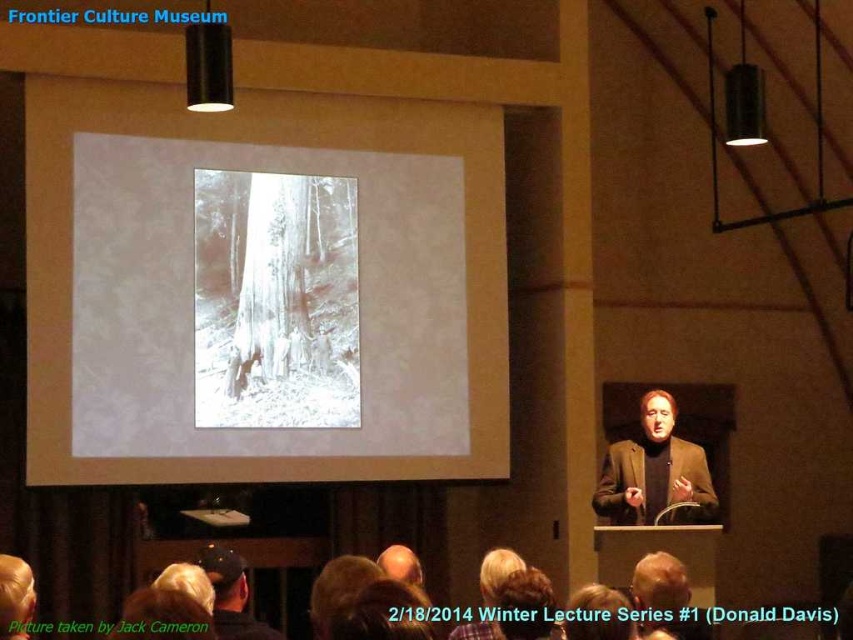
Is white paper at center below black leather cap at lower center?

Incorrect, white paper at center is not positioned below black leather cap at lower center.

Who is taller, white paper at center or black leather cap at lower center?

With more height is white paper at center.

Who is more distant from viewer, (451, 259) or (215, 602)?

Positioned behind is point (451, 259).

At what (x,y) coordinates should I click in order to perform the action: click on white paper at center. Please return your answer as a coordinate pair (x, y). The width and height of the screenshot is (853, 640). Looking at the image, I should click on (358, 273).

Can you confirm if brown woolen sweater at center is shorter than black leather cap at lower center?

No, brown woolen sweater at center is not shorter than black leather cap at lower center.

Which is behind, point (607, 454) or point (252, 630)?

The point (607, 454) is more distant.

What are the coordinates of `brown woolen sweater at center` in the screenshot? It's located at (654, 472).

Is white paper at center taller than brown woolen sweater at center?

Correct, white paper at center is much taller as brown woolen sweater at center.

Between white paper at center and brown woolen sweater at center, which one has more height?

With more height is white paper at center.

The image size is (853, 640). What do you see at coordinates (358, 273) in the screenshot?
I see `white paper at center` at bounding box center [358, 273].

The width and height of the screenshot is (853, 640). What are the coordinates of `white paper at center` in the screenshot? It's located at (358, 273).